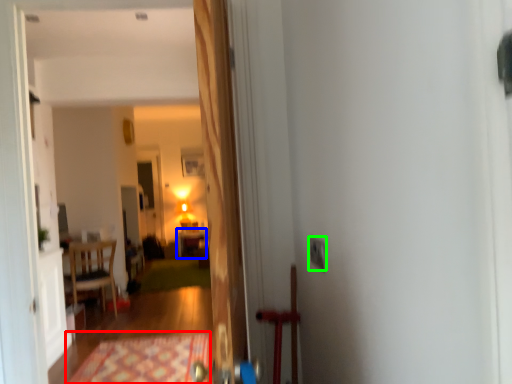
Question: Which object is positioned closest to doormat (highlighted by a red box)? Select from table (highlighted by a blue box) and electric outlet (highlighted by a green box).

Choices:
 (A) table
 (B) electric outlet

Answer: (B)